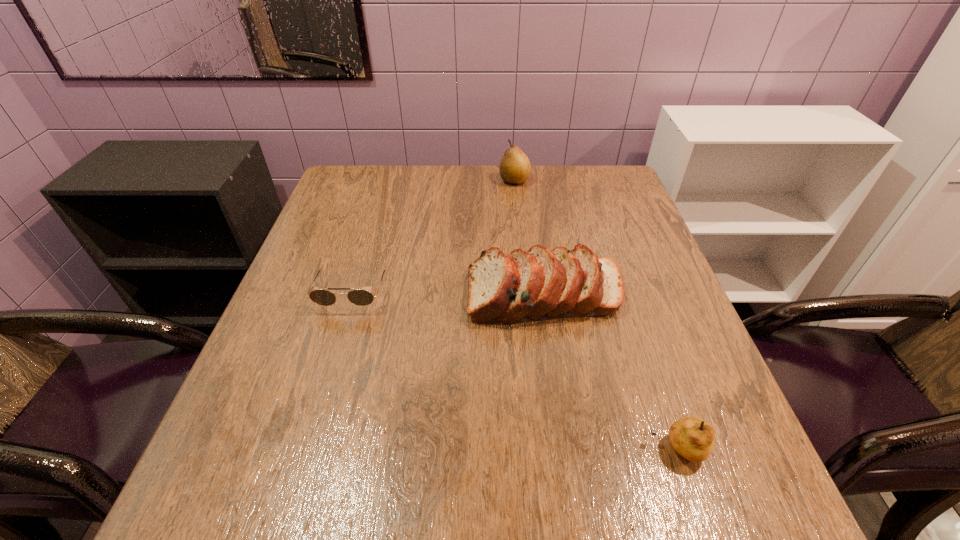
This screenshot has height=540, width=960. I want to click on object that is the second closest to the bread, so click(x=691, y=437).

Image resolution: width=960 pixels, height=540 pixels. In order to click on object that stands as the closest to the taller pear in this screenshot , I will do `click(541, 284)`.

The height and width of the screenshot is (540, 960). In order to click on free space that satisfies the following two spatial constraints: 1. on the front lenses of the shortest object; 2. on the left side of the bread in this screenshot , I will do `click(351, 294)`.

This screenshot has width=960, height=540. I want to click on vacant space that satisfies the following two spatial constraints: 1. on the front lenses of the shortest object; 2. on the right side of the bread, so click(x=351, y=294).

Image resolution: width=960 pixels, height=540 pixels. I want to click on free location that satisfies the following two spatial constraints: 1. on the front lenses of the sunglasses; 2. on the left side of the bread, so click(351, 294).